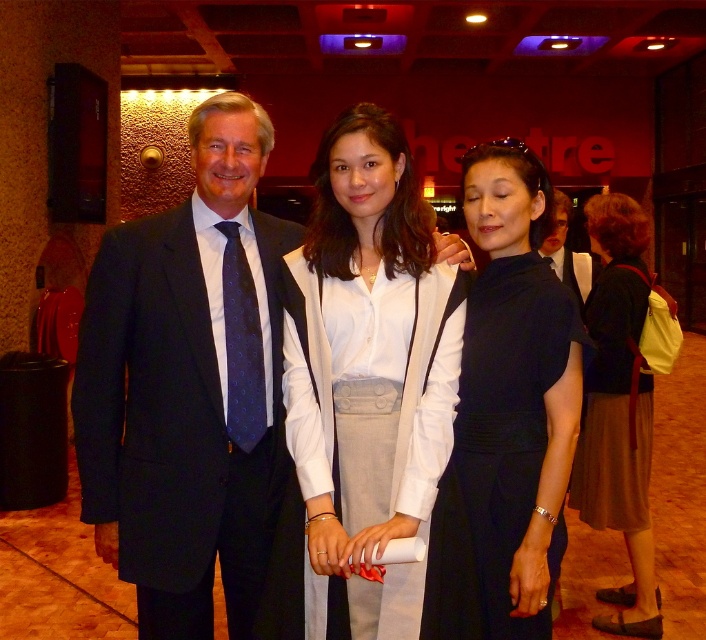
Which is behind, point (173, 369) or point (407, 349)?

Positioned behind is point (173, 369).

Looking at this image, how far apart are dark blue suit at center and white cotton blouse at center?

11.33 inches

The image size is (706, 640). I want to click on dark blue suit at center, so click(189, 387).

Can you confirm if brown fabric skirt at lower right is positioned above dark blue dotted tie at left?

Incorrect, brown fabric skirt at lower right is not positioned above dark blue dotted tie at left.

Which of these two, brown fabric skirt at lower right or dark blue dotted tie at left, stands taller?

brown fabric skirt at lower right

I want to click on brown fabric skirt at lower right, so click(x=618, y=412).

Find the location of a particular element. The image size is (706, 640). brown fabric skirt at lower right is located at coordinates (618, 412).

Which of these two, matte black suit at center or black satin dress at center, stands taller?

matte black suit at center is taller.

You are a GUI agent. You are given a task and a screenshot of the screen. Output one action in this format:
    pyautogui.click(x=<x>, y=<y>)
    Task: Click on the matte black suit at center
    This screenshot has height=640, width=706.
    Given the screenshot: What is the action you would take?
    pyautogui.click(x=225, y=385)

I want to click on matte black suit at center, so click(225, 385).